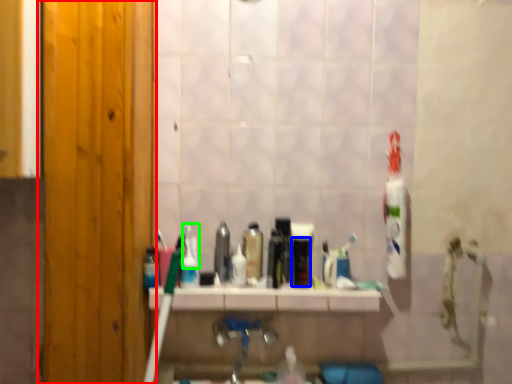
Question: Which object is positioned closest to door (highlighted by a red box)? Select from mouthwash (highlighted by a blue box) and toothpaste (highlighted by a green box).

Choices:
 (A) mouthwash
 (B) toothpaste

Answer: (B)